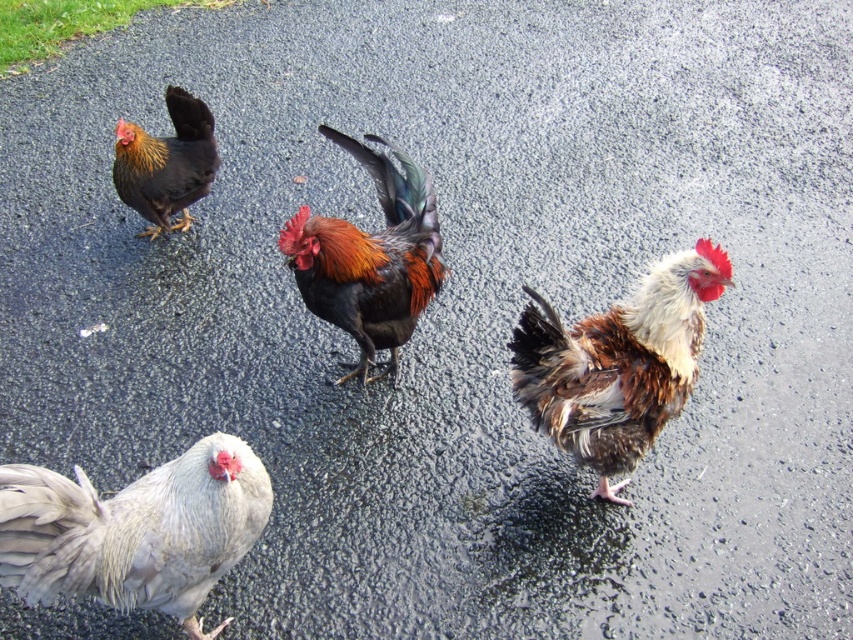
Who is lower down, brown speckled feathers at center or black glossy rooster at upper left?

brown speckled feathers at center is below.

Identify the location of brown speckled feathers at center. Image resolution: width=853 pixels, height=640 pixels. (618, 364).

Locate an element on the screen. The width and height of the screenshot is (853, 640). brown speckled feathers at center is located at coordinates (618, 364).

Is shiny multicolored rooster at center positioned in front of black glossy rooster at upper left?

That is True.

Is shiny multicolored rooster at center wider than black glossy rooster at upper left?

No, shiny multicolored rooster at center is not wider than black glossy rooster at upper left.

Where is `shiny multicolored rooster at center`? This screenshot has height=640, width=853. shiny multicolored rooster at center is located at coordinates (370, 259).

Does white feathered chicken at lower left appear on the left side of shiny multicolored rooster at center?

Yes, white feathered chicken at lower left is to the left of shiny multicolored rooster at center.

Can you confirm if white feathered chicken at lower left is wider than shiny multicolored rooster at center?

Correct, the width of white feathered chicken at lower left exceeds that of shiny multicolored rooster at center.

You are a GUI agent. You are given a task and a screenshot of the screen. Output one action in this format:
    pyautogui.click(x=<x>, y=<y>)
    Task: Click on the white feathered chicken at lower left
    
    Given the screenshot: What is the action you would take?
    [x=134, y=531]

Image resolution: width=853 pixels, height=640 pixels. I want to click on white feathered chicken at lower left, so click(134, 531).